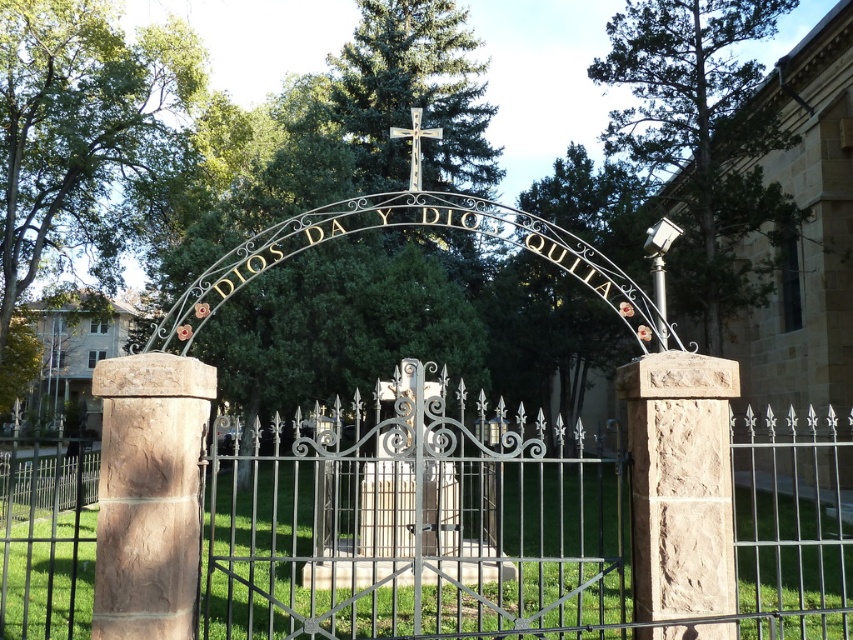
Can you confirm if black wrought iron fence at center is smaller than stone church at left?

Actually, black wrought iron fence at center might be larger than stone church at left.

The height and width of the screenshot is (640, 853). Identify the location of black wrought iron fence at center. (412, 522).

The width and height of the screenshot is (853, 640). I want to click on black wrought iron fence at center, so click(412, 522).

Is point (51, 515) in front of point (416, 122)?

No, (51, 515) is behind (416, 122).

Is black wrought iron fence at center smaller than metallic cross at center?

No, black wrought iron fence at center is not smaller than metallic cross at center.

Locate an element on the screen. The height and width of the screenshot is (640, 853). black wrought iron fence at center is located at coordinates (412, 522).

Can you confirm if stone church at left is positioned to the right of metallic cross at center?

No, stone church at left is not to the right of metallic cross at center.

This screenshot has width=853, height=640. In order to click on stone church at left in this screenshot , I will do `click(73, 356)`.

Is point (86, 412) more distant than point (416, 148)?

Yes, it is behind point (416, 148).

Identify the location of stone church at left. The width and height of the screenshot is (853, 640). (73, 356).